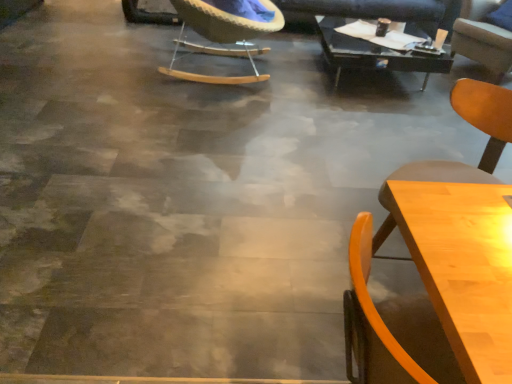
Question: Which direction should I rotate to look at woven fabric chair at upper center, the second chair when ordered from back to front?

Choices:
 (A) right
 (B) left

Answer: (B)

Question: Can you confirm if light wood chair at lower right, positioned as the second chair in left-to-right order, is positioned to the left of black glass table at upper center, which is counted as the first table, starting from the back?

Choices:
 (A) yes
 (B) no

Answer: (A)

Question: Does light wood chair at lower right, the 2th chair when ordered from right to left, contain black glass table at upper center, the 1th table viewed from the top?

Choices:
 (A) yes
 (B) no

Answer: (B)

Question: Would you say light wood chair at lower right, arranged as the 3th chair when viewed from the back, is a long distance from black glass table at upper center, the second table when ordered from left to right?

Choices:
 (A) yes
 (B) no

Answer: (A)

Question: From a real-world perspective, is light wood chair at lower right, arranged as the 3th chair when viewed from the back, physically above black glass table at upper center, placed as the second table when sorted from bottom to top?

Choices:
 (A) yes
 (B) no

Answer: (A)

Question: Can you confirm if light wood chair at lower right, arranged as the 3th chair when viewed from the back, is bigger than black glass table at upper center, which is counted as the first table, starting from the back?

Choices:
 (A) no
 (B) yes

Answer: (A)

Question: Does light wood chair at lower right, positioned as the second chair in left-to-right order, lie behind black glass table at upper center, marked as the 2th table in a front-to-back arrangement?

Choices:
 (A) no
 (B) yes

Answer: (A)

Question: Can you confirm if light wood chair at lower right, the 2th chair when ordered from right to left, is positioned to the right of light brown wood chair at upper right, which is counted as the 1th chair, starting from the right?

Choices:
 (A) no
 (B) yes

Answer: (A)

Question: Considering the relative sizes of light wood chair at lower right, arranged as the first chair when viewed from the front, and light brown wood chair at upper right, the first chair in the back-to-front sequence, in the image provided, is light wood chair at lower right, arranged as the first chair when viewed from the front, smaller than light brown wood chair at upper right, the first chair in the back-to-front sequence,?

Choices:
 (A) no
 (B) yes

Answer: (B)

Question: Considering the relative sizes of light wood chair at lower right, the 2th chair when ordered from right to left, and light brown wood chair at upper right, positioned as the third chair in front-to-back order, in the image provided, is light wood chair at lower right, the 2th chair when ordered from right to left, thinner than light brown wood chair at upper right, positioned as the third chair in front-to-back order,?

Choices:
 (A) yes
 (B) no

Answer: (A)

Question: Is light wood chair at lower right, arranged as the 3th chair when viewed from the back, further to the viewer compared to light brown wood chair at upper right, the 3th chair positioned from the left?

Choices:
 (A) no
 (B) yes

Answer: (A)

Question: Can you confirm if light wood chair at lower right, arranged as the first chair when viewed from the front, is positioned to the left of light brown wood chair at upper right, which is counted as the 1th chair, starting from the right?

Choices:
 (A) no
 (B) yes

Answer: (B)

Question: From the image's perspective, would you say light wood chair at lower right, the 2th chair when ordered from right to left, is shown under light brown wood chair at upper right, positioned as the third chair in front-to-back order?

Choices:
 (A) yes
 (B) no

Answer: (A)

Question: Considering the relative sizes of woven fabric chair at upper center, the second chair when ordered from back to front, and light wood chair at lower right, positioned as the second chair in left-to-right order, in the image provided, is woven fabric chair at upper center, the second chair when ordered from back to front, smaller than light wood chair at lower right, positioned as the second chair in left-to-right order,?

Choices:
 (A) yes
 (B) no

Answer: (B)